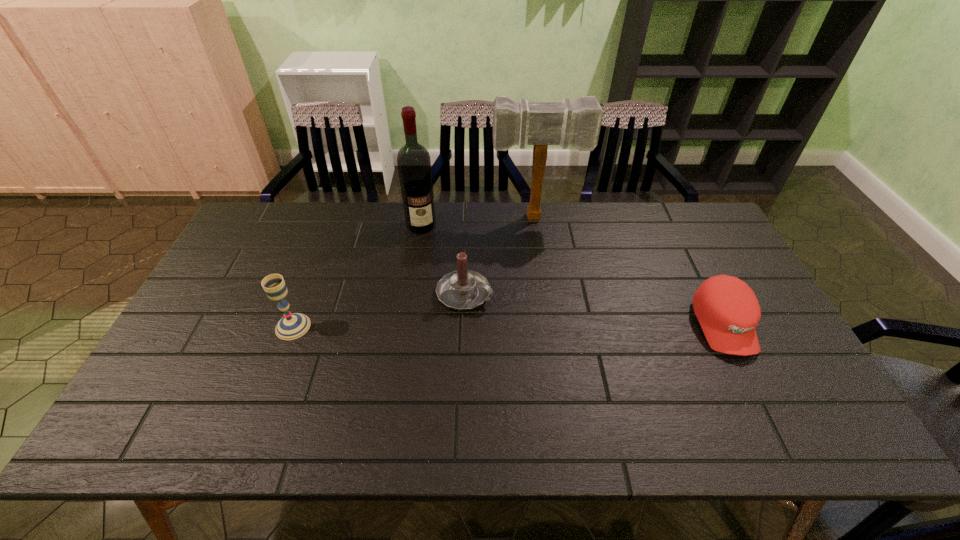
This screenshot has width=960, height=540. What are the coordinates of `free space at the far edge of the desktop` in the screenshot? It's located at (604, 219).

This screenshot has height=540, width=960. Find the location of `vacant space at the near edge of the desktop`. vacant space at the near edge of the desktop is located at coordinates pyautogui.click(x=592, y=401).

Identify the location of vacant space at the left edge of the desktop. The width and height of the screenshot is (960, 540). (238, 306).

Image resolution: width=960 pixels, height=540 pixels. In order to click on free space at the right edge of the desktop in this screenshot , I will do `click(756, 332)`.

In the image, there is a desktop. Identify the location of vacant space at the far left corner. (285, 210).

I want to click on vacant space in between the mallet and the third object from left to right, so click(x=500, y=256).

What are the coordinates of `vacant point located between the chalice and the rightmost object` in the screenshot? It's located at coord(508,326).

The width and height of the screenshot is (960, 540). In order to click on free space between the leftmost object and the second object from left to right in this screenshot , I will do `click(357, 276)`.

At what (x,y) coordinates should I click in order to perform the action: click on unoccupied position between the shortest object and the fourth object from left to right. Please return your answer as a coordinate pair (x, y). This screenshot has height=540, width=960. Looking at the image, I should click on (630, 272).

Locate an element on the screen. Image resolution: width=960 pixels, height=540 pixels. free space between the shortest object and the alcohol is located at coordinates (572, 275).